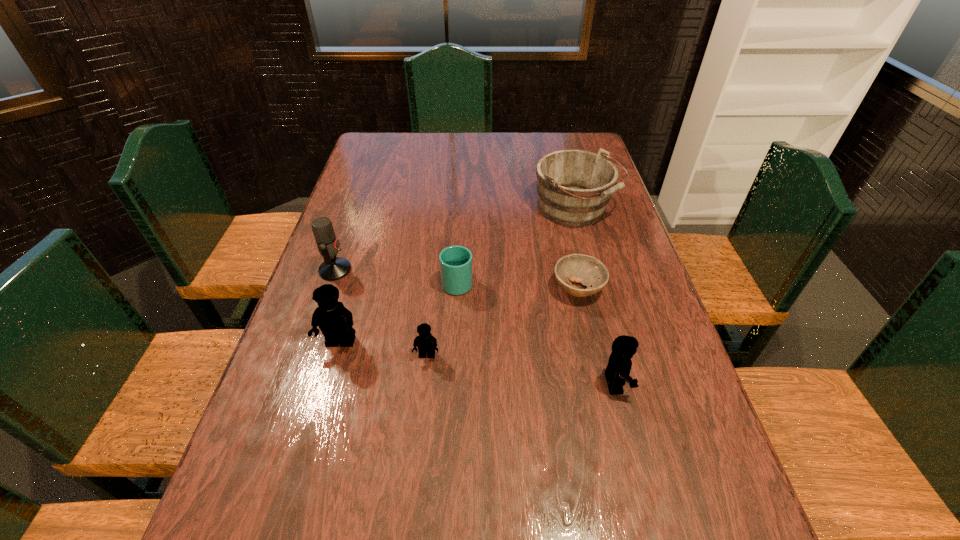
Find the location of a particular element. This screenshot has height=540, width=960. wine bucket at the right edge is located at coordinates (574, 187).

Image resolution: width=960 pixels, height=540 pixels. In order to click on bowl at the right edge in this screenshot , I will do `click(587, 270)`.

In the image, there is a desktop. Identify the location of blank space at the far edge. (489, 142).

In the image, there is a desktop. Where is `vacant space at the near edge`? The image size is (960, 540). vacant space at the near edge is located at coordinates (363, 457).

This screenshot has width=960, height=540. In order to click on vacant space at the left edge of the desktop in this screenshot , I will do `click(390, 197)`.

The image size is (960, 540). What are the coordinates of `vacant area at the right edge` in the screenshot? It's located at (647, 320).

In order to click on free space at the far left corner of the desktop in this screenshot , I will do `click(359, 160)`.

At what (x,y) coordinates should I click in order to perform the action: click on empty space between the microphone and the second tallest Lego. Please return your answer as a coordinate pair (x, y). The height and width of the screenshot is (540, 960). Looking at the image, I should click on tap(475, 327).

Locate an element on the screen. vacant area that lies between the cup and the farthest object is located at coordinates (516, 245).

The image size is (960, 540). I want to click on blank region between the bowl and the wine bucket, so click(577, 249).